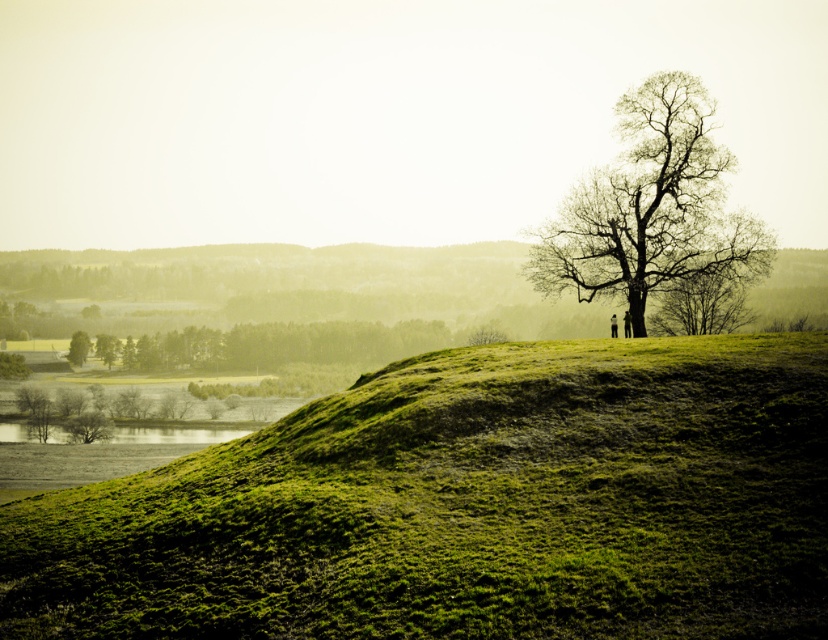
You are standing at the center of the hill and want to walk towards the bare wood tree at upper right. In which general direction should you head?

The bare wood tree at upper right is located at point coordinates, so you should head towards the upper right direction to reach it.

You are a hiker planning to take a photo of the green mossy hillside at lower left. However, there is a bare branches at upper right in your view. Can you adjust your position to exclude the branches from the photo without moving the camera horizontally?

The bare branches at upper right is in front of green mossy hillside at lower left, so you can move the camera backward to create distance between the branches and the hillside, allowing the branches to be out of frame while still capturing the hillside.

You are standing at the base of the hill and looking towards the solitary tree on the right side. There is a point marked at coordinates [706,300]. What does this point indicate?

The point at [706,300] marks the location of the bare branches at the upper right of the solitary tree on the right side of the hill.